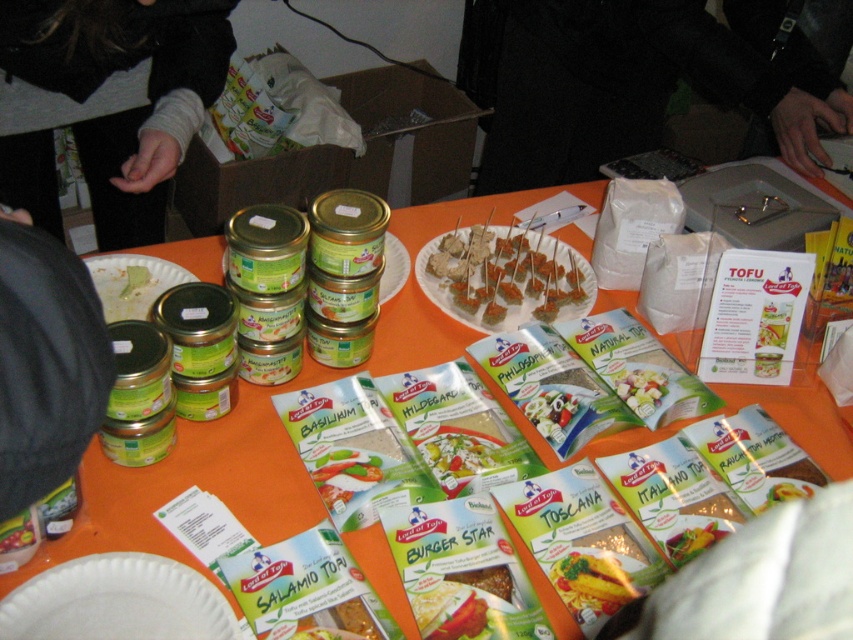
Question: Does brown crumbly at center have a smaller size compared to yellowish matte cheese at center?

Choices:
 (A) yes
 (B) no

Answer: (B)

Question: Estimate the real-world distances between objects in this image. Which object is farther from the black fabric hand at upper left?

Choices:
 (A) green matte pasta at center
 (B) white paper plate at upper left
 (C) black fabric at left

Answer: (A)

Question: Does brown crumbly at center have a greater width compared to yellow matte pasta at center?

Choices:
 (A) yes
 (B) no

Answer: (A)

Question: Which point is farther to the camera?

Choices:
 (A) (331, 499)
 (B) (94, 627)

Answer: (A)

Question: Is white paper plate at upper left positioned before white paper plate at center?

Choices:
 (A) yes
 (B) no

Answer: (B)

Question: Based on their relative distances, which object is farther from the brown crumbly at center?

Choices:
 (A) yellow matte pasta at center
 (B) white paper plate at center

Answer: (A)